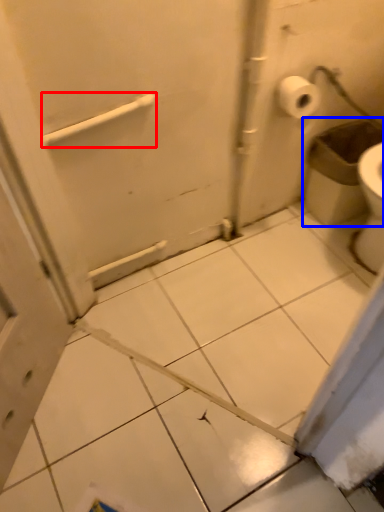
Question: Among these objects, which one is farthest to the camera, towel bar (highlighted by a red box) or garbage (highlighted by a blue box)?

Choices:
 (A) towel bar
 (B) garbage

Answer: (B)